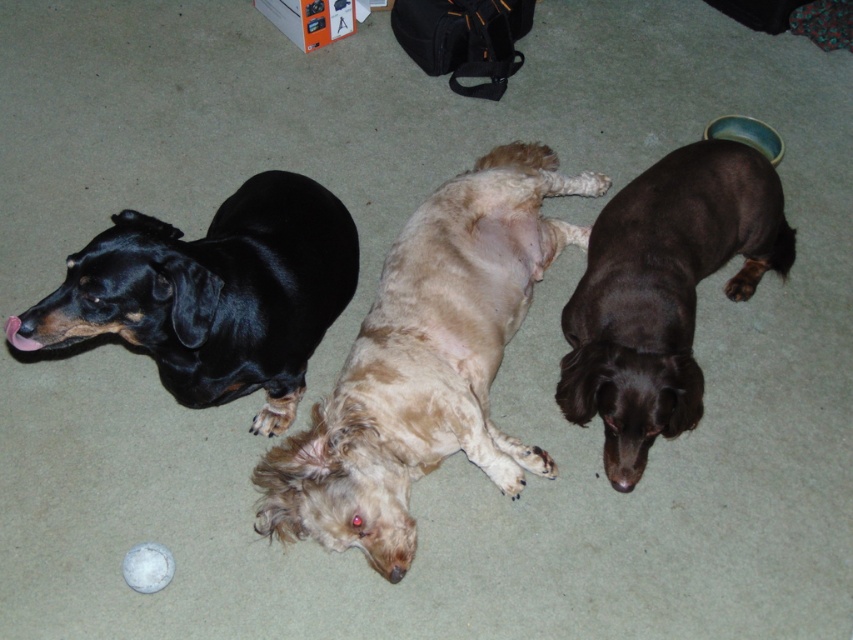
You are standing in front of the three dogs and want to place a small toy between the two points marked as point [288,528] and point [280,422]. Which point is closer to you so you can place the toy there first?

Point [288,528] is closer to the viewer than point [280,422], so you should place the toy near point [288,528] first.

You are a dog owner who wants to throw a ball for your dog. You see the light brown fur at center and the white matte ball at lower center. Which object is closer to you so you can reach it first?

The light brown fur at center is closer to the viewer than the white matte ball at lower center, so you can reach it first.

You are a robotic vacuum cleaner with a diameter of 35 centimeters. You are currently positioned near the shiny black dachshund at left and want to move to the white matte ball at lower center. Can you navigate directly to the ball without any obstacles?

The distance between the shiny black dachshund at left and the white matte ball at lower center is 46.22 centimeters. Since the vacuum cleaner has a diameter of 35 centimeters, it can navigate the space as the distance is greater than the vacuum cleaner size. However, the path might be obstructed by other objects not mentioned in the scene description, so proceed with caution.